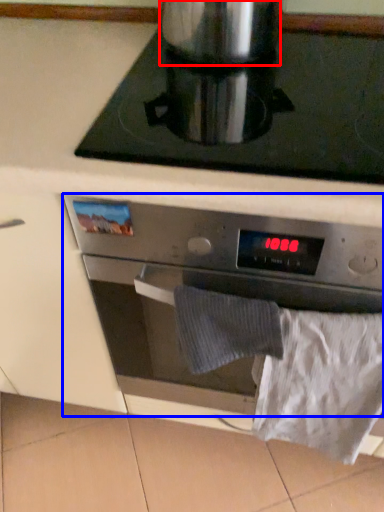
Question: Which object is further to the camera taking this photo, appliance (highlighted by a red box) or kitchen appliance (highlighted by a blue box)?

Choices:
 (A) appliance
 (B) kitchen appliance

Answer: (A)